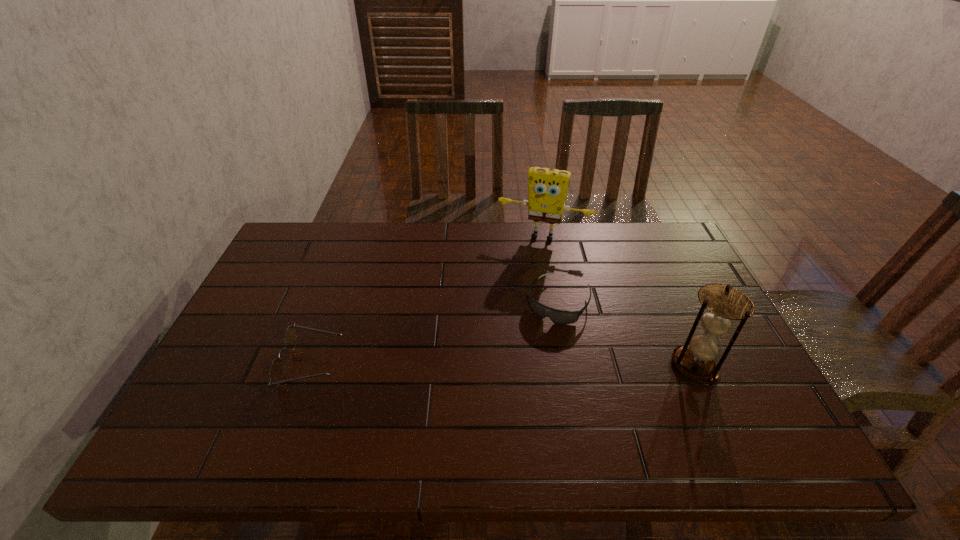
Locate an element on the screen. This screenshot has width=960, height=540. vacant region located 0.060m on the face of the farthest object is located at coordinates (529, 256).

In order to click on vacant space located on the face of the farthest object in this screenshot , I will do `click(528, 262)`.

You are a GUI agent. You are given a task and a screenshot of the screen. Output one action in this format:
    pyautogui.click(x=<x>, y=<y>)
    Task: Click on the vacant space located 0.090m on the face of the farthest object
    The image size is (960, 540).
    Given the screenshot: What is the action you would take?
    pyautogui.click(x=528, y=262)

Where is `object positioned at the far edge`? The image size is (960, 540). object positioned at the far edge is located at coordinates (547, 188).

The image size is (960, 540). What are the coordinates of `spectacles present at the near edge` in the screenshot? It's located at (276, 369).

In order to click on hourglass located at the near edge in this screenshot , I will do `click(722, 304)`.

This screenshot has width=960, height=540. I want to click on object that is at the right edge, so click(x=722, y=304).

I want to click on object at the near right corner, so click(722, 304).

The image size is (960, 540). I want to click on free space at the far edge, so click(482, 228).

Where is `blank area at the near edge`? The width and height of the screenshot is (960, 540). blank area at the near edge is located at coordinates point(286,414).